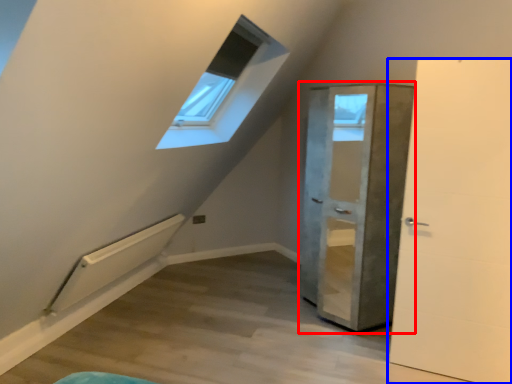
Question: Which object appears farthest to the camera in this image, door (highlighted by a red box) or door (highlighted by a blue box)?

Choices:
 (A) door
 (B) door

Answer: (A)